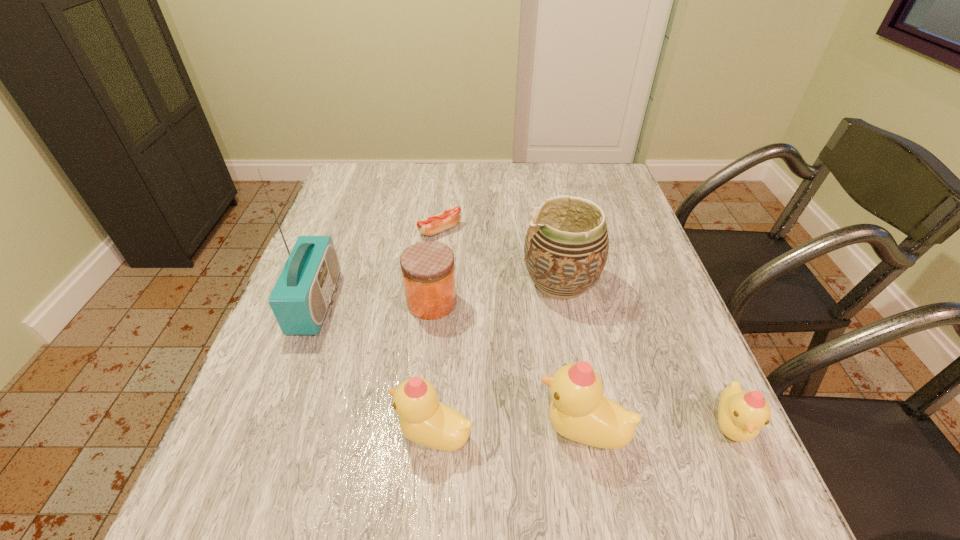
I want to click on the leftmost duckling, so click(424, 420).

The height and width of the screenshot is (540, 960). What are the coordinates of `the second duckling from right to left` in the screenshot? It's located at click(x=578, y=411).

Image resolution: width=960 pixels, height=540 pixels. Identify the location of the rightmost duckling. (741, 414).

Locate an element on the screen. This screenshot has height=540, width=960. the shortest duckling is located at coordinates (741, 414).

Locate an element on the screen. This screenshot has width=960, height=540. the farthest object is located at coordinates (429, 226).

Identify the location of the shortest object. (429, 226).

The image size is (960, 540). Identify the location of the second tallest object. (566, 247).

At what (x,y) coordinates should I click in order to perform the action: click on radio receiver. Please return your answer as a coordinate pair (x, y). The height and width of the screenshot is (540, 960). Looking at the image, I should click on (300, 298).

In order to click on the tallest object in this screenshot , I will do `click(300, 298)`.

Where is `jar`? The height and width of the screenshot is (540, 960). jar is located at coordinates (428, 274).